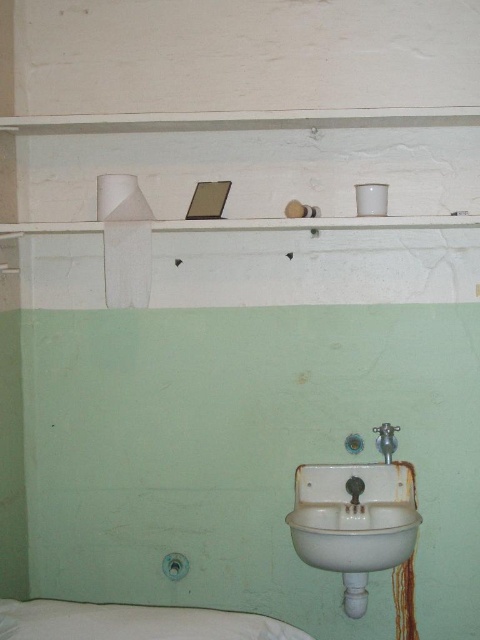
Is point (200, 625) closer to camera compared to point (384, 445)?

Yes.

Does white fabric bed at lower left have a greater width compared to silver metallic faucet at lower center?

Yes.

Between point (69, 632) and point (397, 426), which one is positioned behind?

Point (397, 426)

Find the location of a particular element. The height and width of the screenshot is (640, 480). white fabric bed at lower left is located at coordinates (132, 621).

Is point (373, 484) less distant than point (357, 493)?

No, it is behind (357, 493).

Locate an element on the screen. white porcelain sink at lower center is located at coordinates (354, 516).

Between point (389, 452) and point (354, 497), which one is positioned behind?

The point (389, 452) is more distant.

Is point (385, 452) positioned in front of point (352, 481)?

That is True.

Locate an element on the screen. silver metallic faucet at lower center is located at coordinates pyautogui.click(x=385, y=440).